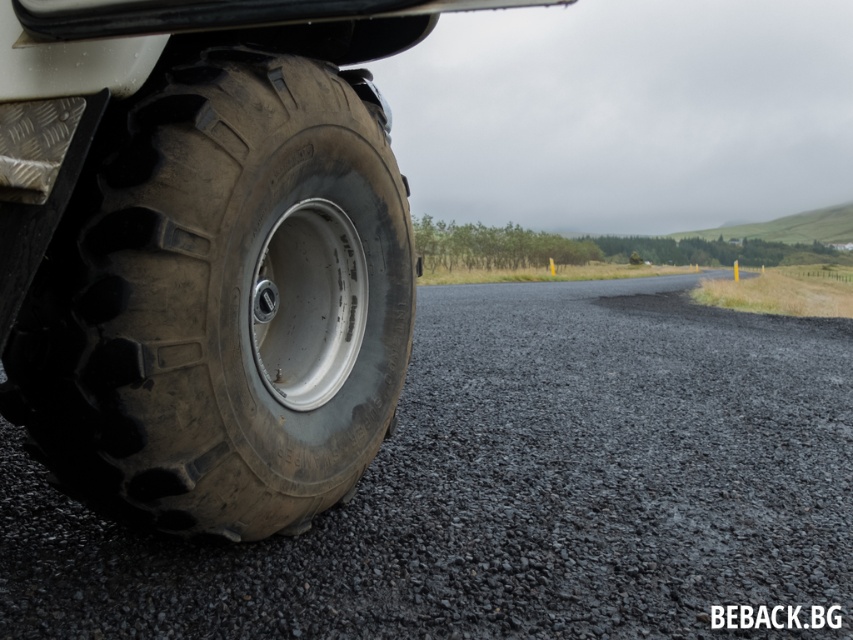
You are driving an offroad vehicle and notice the black rubber tire at lower left and the black gravel at lower left. Which object is closer to the ground?

The black gravel at lower left is closer to the ground because it is located below the black rubber tire at lower left.

In the scene shown: You are standing on the road and see the black gravel at lower left and the black rubber tire at lower left. Which object is located to the right when facing the image?

The black gravel at lower left is positioned on the right side of the black rubber tire at lower left, so the black gravel at lower left is to the right when facing the image.

You are driving an offroad vehicle with a large rugged tire mounted on it. You notice that the road ahead has a point at coordinate (511, 490) where black gravel is located at lower left. Will the tire with deep treads be able to handle the black gravel at lower left at that point?

The tire with deep treads is designed for traction on uneven terrain, so it should be able to handle the black gravel at lower left at that point effectively.